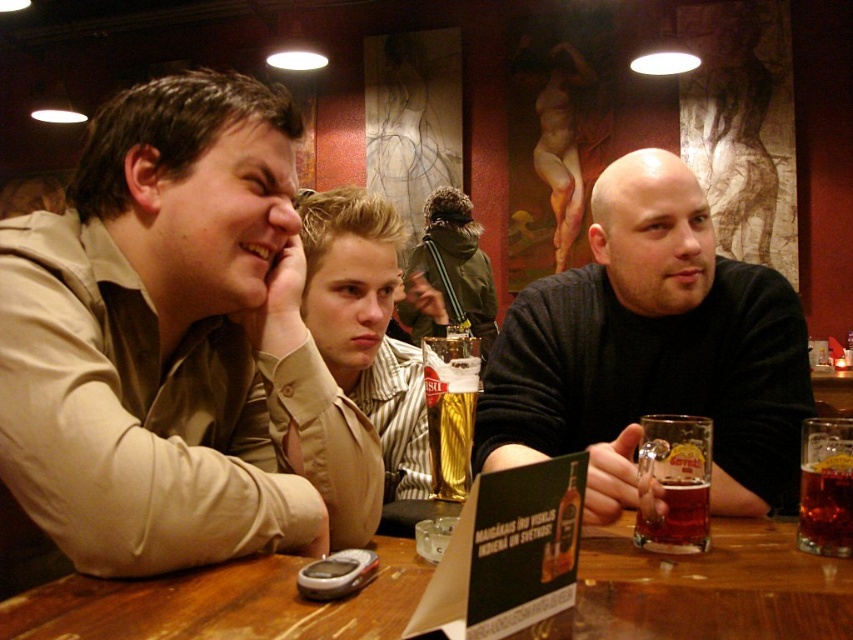
Question: Where is wooden table at center located in relation to brown glass beer at table center in the image?

Choices:
 (A) left
 (B) right

Answer: (A)

Question: Based on their relative distances, which object is farther from the translucent amber glass mug at right?

Choices:
 (A) matte khaki shirt at left
 (B) translucent glass mug at table center
 (C) brown glass beer at table center
 (D) dark gray sweater at center

Answer: (A)

Question: Considering the real-world distances, which object is closest to the translucent glass mug at table center?

Choices:
 (A) translucent amber glass mug at right
 (B) striped shirt at center
 (C) matte khaki shirt at left
 (D) wooden table at center

Answer: (A)

Question: Is dark gray sweater at center in front of striped shirt at center?

Choices:
 (A) no
 (B) yes

Answer: (B)

Question: Is wooden table at center thinner than brown glass beer at table center?

Choices:
 (A) no
 (B) yes

Answer: (A)

Question: Which point is closer to the camera taking this photo?

Choices:
 (A) (796, 588)
 (B) (840, 477)
 (C) (369, 250)

Answer: (A)